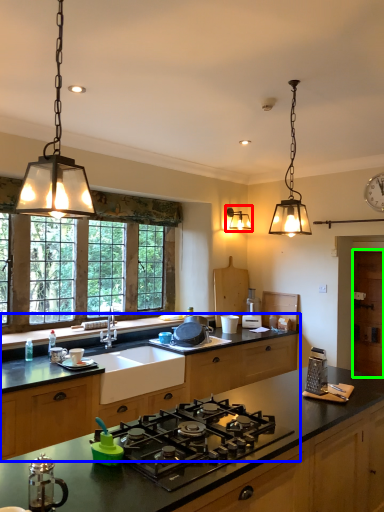
Question: Based on their relative distances, which object is farther from light fixture (highlighted by a red box)? Choose from cabinetry (highlighted by a blue box) and cabinetry (highlighted by a green box).

Choices:
 (A) cabinetry
 (B) cabinetry

Answer: (A)